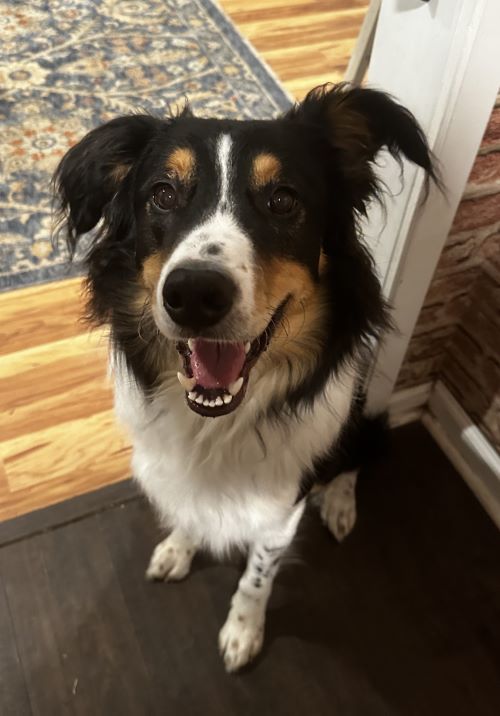
You are a GUI agent. You are given a task and a screenshot of the screen. Output one action in this format:
    pyautogui.click(x=<x>, y=<y>)
    Task: Click on the floor
    The height and width of the screenshot is (716, 500).
    Given the screenshot: What is the action you would take?
    coord(43,381), coord(303,38)